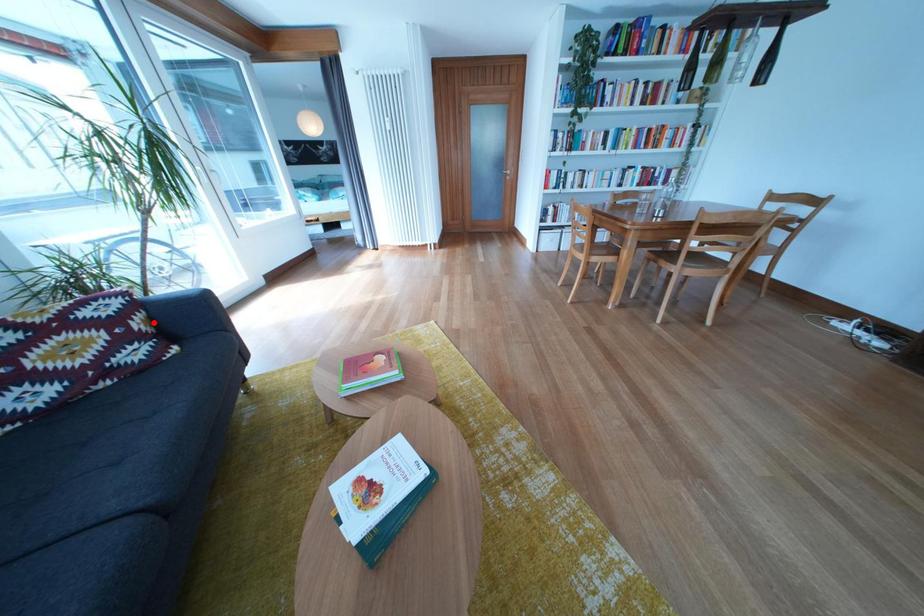
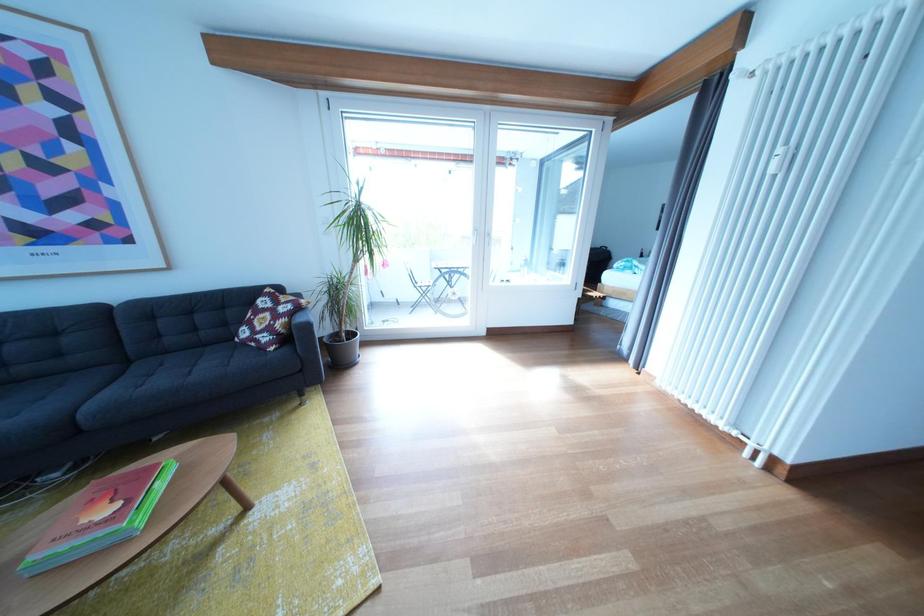
Question: I am providing you with two images of the same scene from different viewpoints. A red point is shown in image1. For the corresponding object point in image2, is it positioned nearer or farther from the camera?

Choices:
 (A) Nearer
 (B) Farther

Answer: (A)